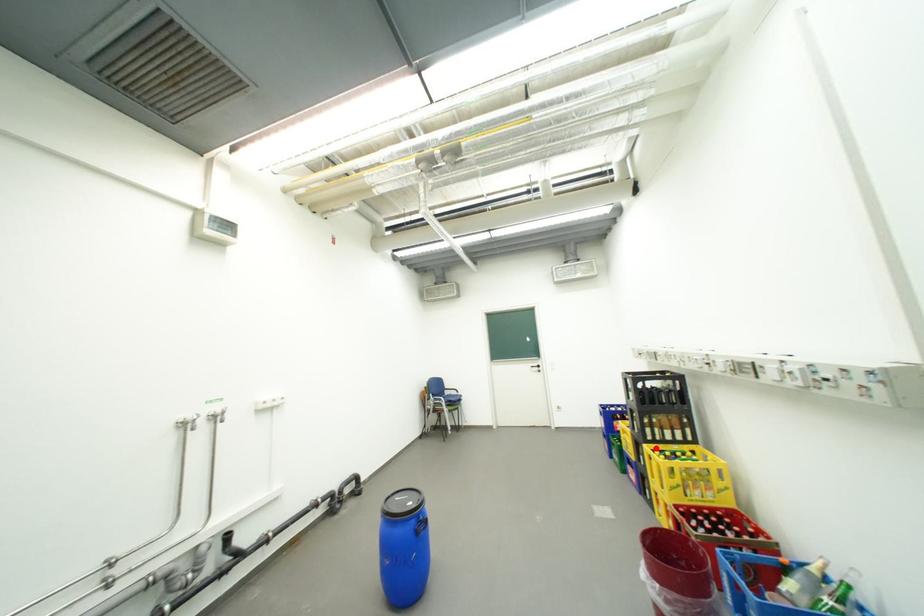
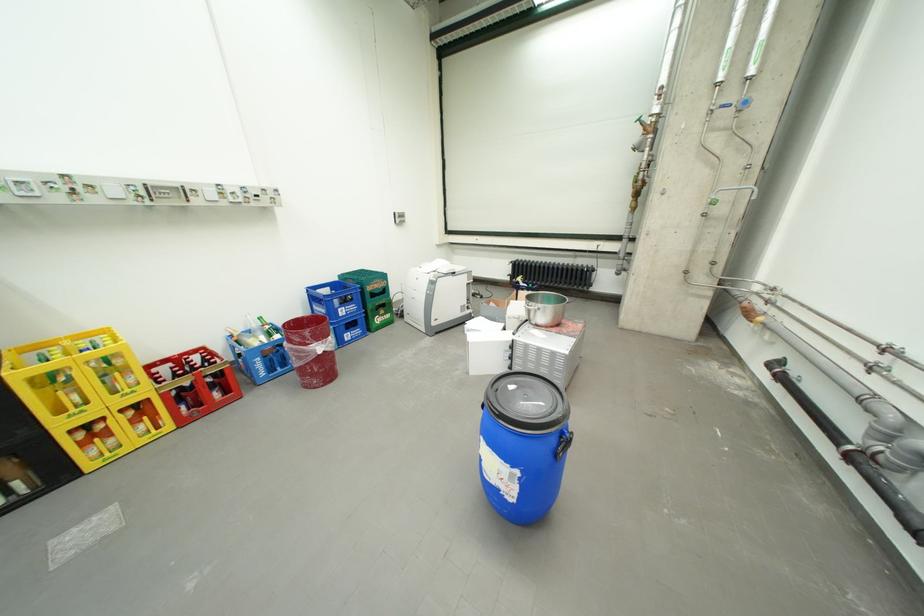
The point at the highlighted location is marked in the first image. Where is the corresponding point in the second image?

(30, 374)